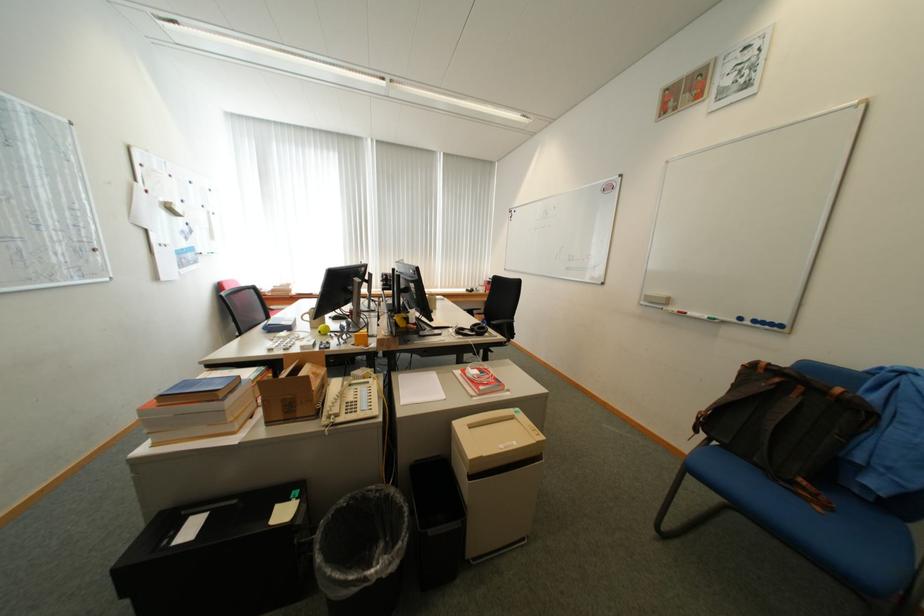
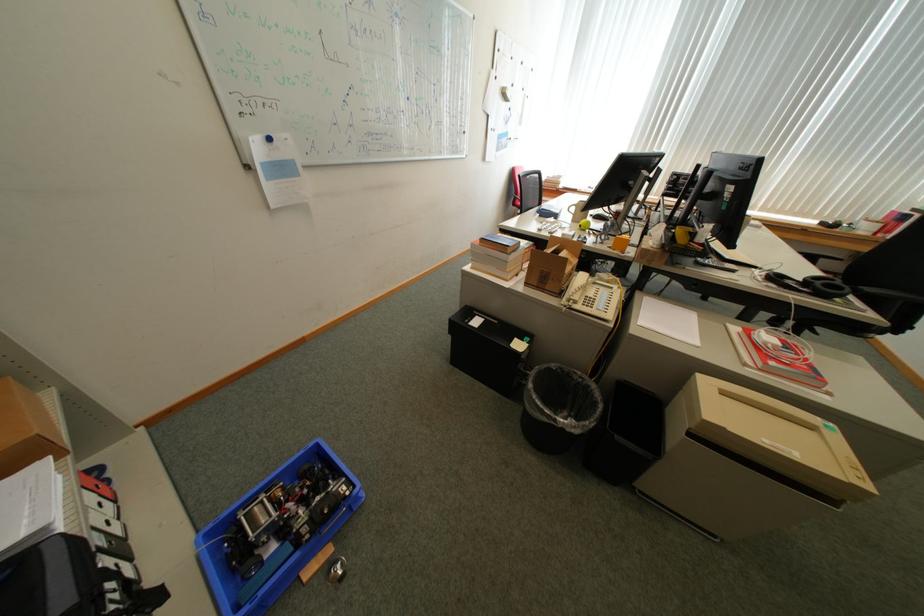
Where in the second image is the point corresponding to [521,419] from the first image?

(820, 428)